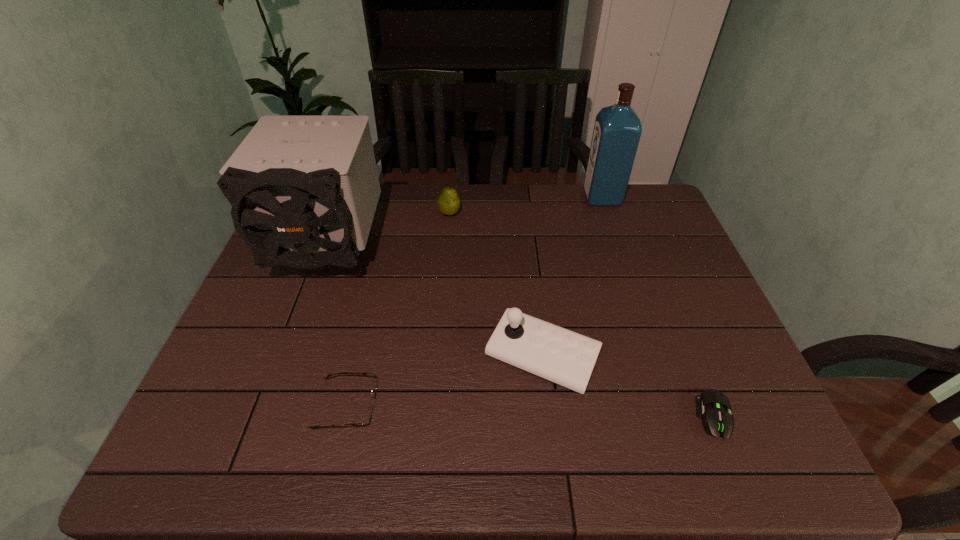
Identify the location of empty space that is in between the fan and the third shortest object. pos(390,233).

What are the coordinates of `empty space between the liquor and the spectacles` in the screenshot? It's located at (474, 302).

Where is `object that ranks as the fourth closest to the fifth tallest object`? Image resolution: width=960 pixels, height=540 pixels. object that ranks as the fourth closest to the fifth tallest object is located at coordinates (717, 417).

Locate an element on the screen. the third closest object relative to the fourth object from left to right is located at coordinates (304, 189).

Locate an element on the screen. The height and width of the screenshot is (540, 960). free location that satisfies the following two spatial constraints: 1. on the flat label side of the shortest object; 2. on the right side of the liquor is located at coordinates (676, 416).

Where is `blank area in the image that satisfies the following two spatial constraints: 1. on the front side of the fourth object from left to right; 2. on the left side of the pear`? The image size is (960, 540). blank area in the image that satisfies the following two spatial constraints: 1. on the front side of the fourth object from left to right; 2. on the left side of the pear is located at coordinates (438, 356).

Locate an element on the screen. Image resolution: width=960 pixels, height=540 pixels. blank area in the image that satisfies the following two spatial constraints: 1. on the front side of the joystick; 2. on the right side of the shortest object is located at coordinates (549, 416).

You are a GUI agent. You are given a task and a screenshot of the screen. Output one action in this format:
    pyautogui.click(x=<x>, y=<y>)
    Task: Click on the free space that satisfies the following two spatial constraints: 1. on the front side of the joystick; 2. on the front-facing side of the spectacles
    
    Given the screenshot: What is the action you would take?
    pyautogui.click(x=548, y=407)

Locate an element on the screen. free space in the image that satisfies the following two spatial constraints: 1. on the front-facing side of the spectacles; 2. on the left side of the computer mouse is located at coordinates (344, 416).